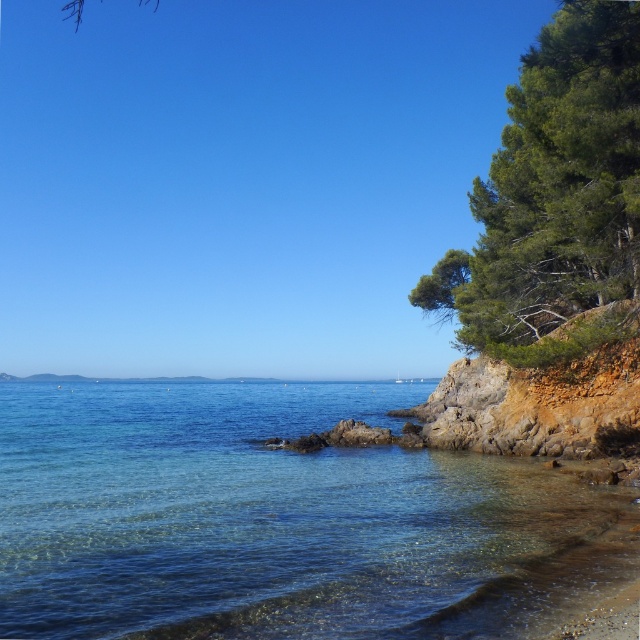
Question: Is clear water at lower right to the left of green textured tree at right from the viewer's perspective?

Choices:
 (A) yes
 (B) no

Answer: (A)

Question: Is clear water at lower right below green textured tree at right?

Choices:
 (A) no
 (B) yes

Answer: (B)

Question: Does clear water at lower right appear over green textured tree at right?

Choices:
 (A) no
 (B) yes

Answer: (A)

Question: Which point is farther to the camera?

Choices:
 (A) (145, 422)
 (B) (605, 157)

Answer: (A)